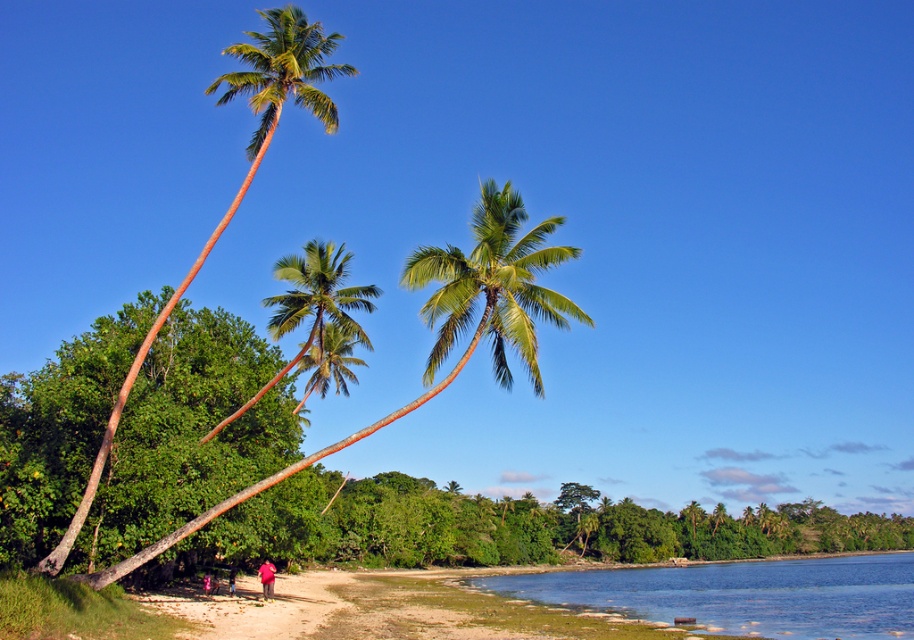
Measure the distance between point (856, 605) and camera.

Point (856, 605) and camera are 40.83 meters apart.

Can you confirm if blue water at lower center is positioned below green leafy palm tree at left?

Correct, blue water at lower center is located below green leafy palm tree at left.

Measure the distance between blue water at lower center and camera.

They are 27.33 meters apart.

Where is `blue water at lower center`? This screenshot has height=640, width=914. blue water at lower center is located at coordinates (742, 595).

Is point (647, 602) in front of point (271, 582)?

No, it is not.

Which of these two, blue water at lower center or red cotton shirt at lower center, stands shorter?

With less height is red cotton shirt at lower center.

What do you see at coordinates (742, 595) in the screenshot? Image resolution: width=914 pixels, height=640 pixels. I see `blue water at lower center` at bounding box center [742, 595].

Where is `blue water at lower center`? blue water at lower center is located at coordinates (742, 595).

Who is positioned more to the left, green leafy palm tree at left or red cotton shirt at lower center?

Positioned to the left is green leafy palm tree at left.

How far apart are green leafy palm tree at left and red cotton shirt at lower center?

green leafy palm tree at left and red cotton shirt at lower center are 89.38 meters apart from each other.

Who is more distant from viewer, (x=252, y=140) or (x=263, y=588)?

Positioned behind is point (x=252, y=140).

Where is `green leafy palm tree at left`? green leafy palm tree at left is located at coordinates (245, 176).